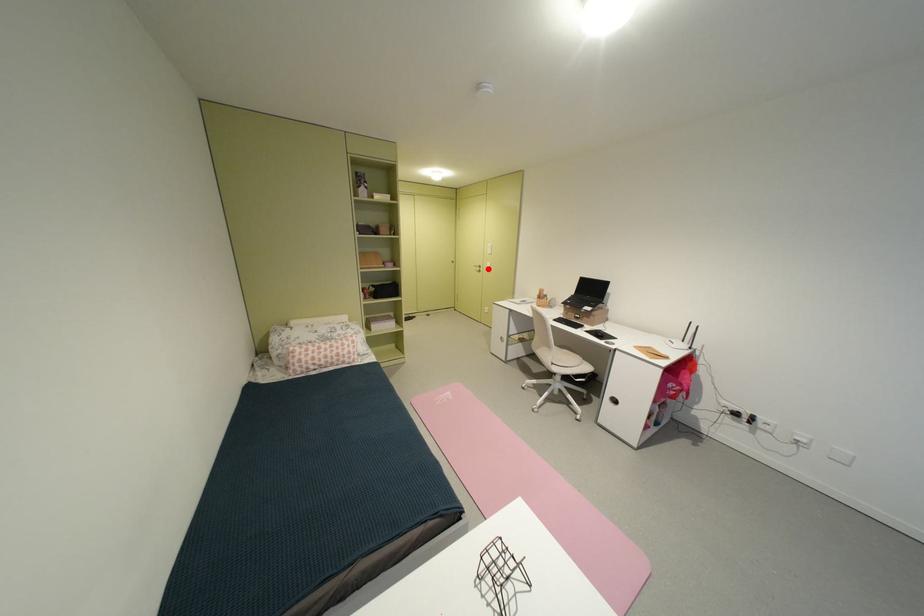
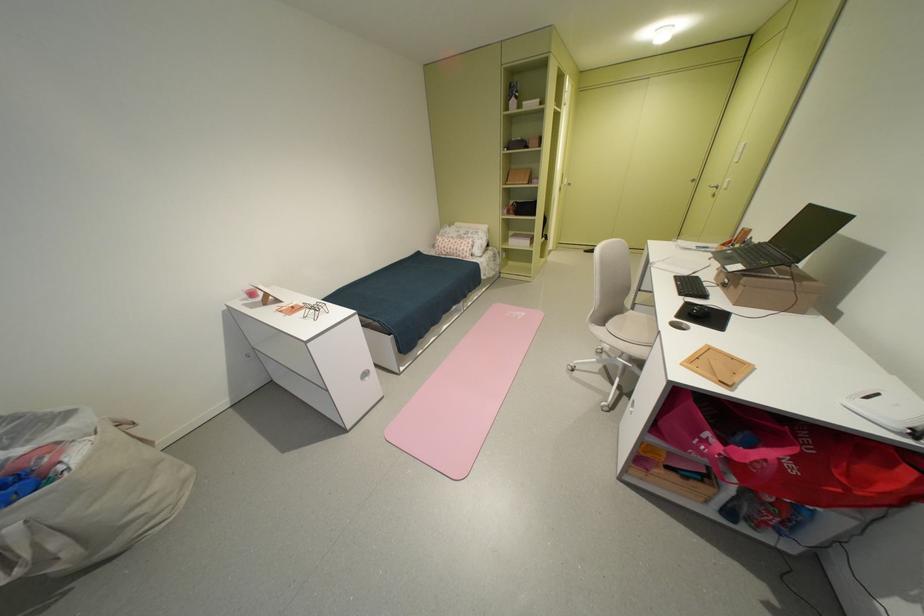
Locate, in the second image, the point that corresponds to the highlighted location in the first image.

(724, 190)